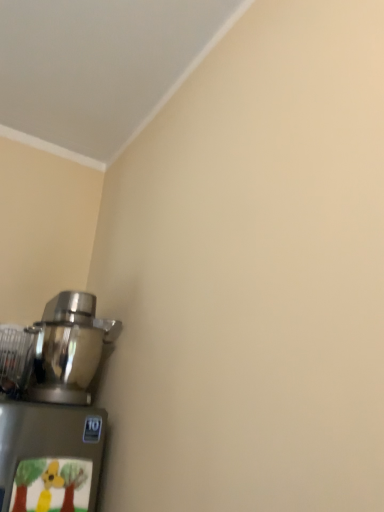
Describe the element at coordinates (68, 349) in the screenshot. I see `shiny metallic mixer at lower left` at that location.

Image resolution: width=384 pixels, height=512 pixels. I want to click on shiny metallic mixer at lower left, so click(x=68, y=349).

Where is `shiny metallic mixer at lower left`? The width and height of the screenshot is (384, 512). shiny metallic mixer at lower left is located at coordinates (68, 349).